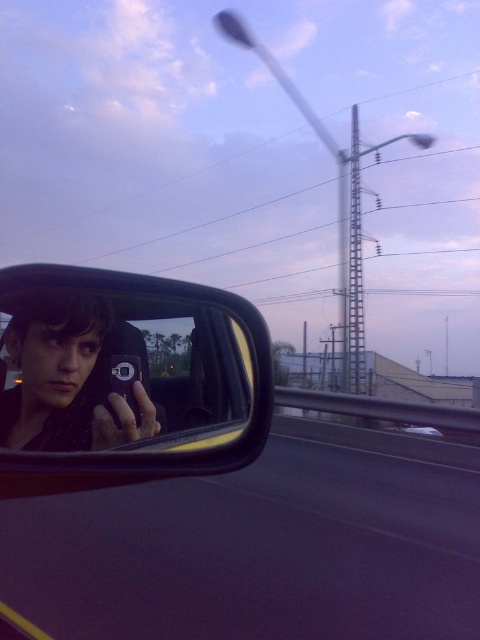
You are inside a car and want to take a photo of the metallic silver car at center using the shiny black phone at center. Can you take the photo without the phone being visible in the reflection of the car?

The shiny black phone at center is in front of the metallic silver car at center, so when taking the photo, the phone would be positioned between the photographer and the car. This placement might cause the phone to block the view of the car or its reflection, making it difficult to capture a clear photo of the metallic silver car at center without the phone appearing in the reflection.

You are taking a photo using your shiny black phone at center and notice the metallic silver car at center reflected in the side mirror. Which object appears larger in the reflection?

The shiny black phone at center appears larger in the reflection because it is physically bigger than the metallic silver car at center.